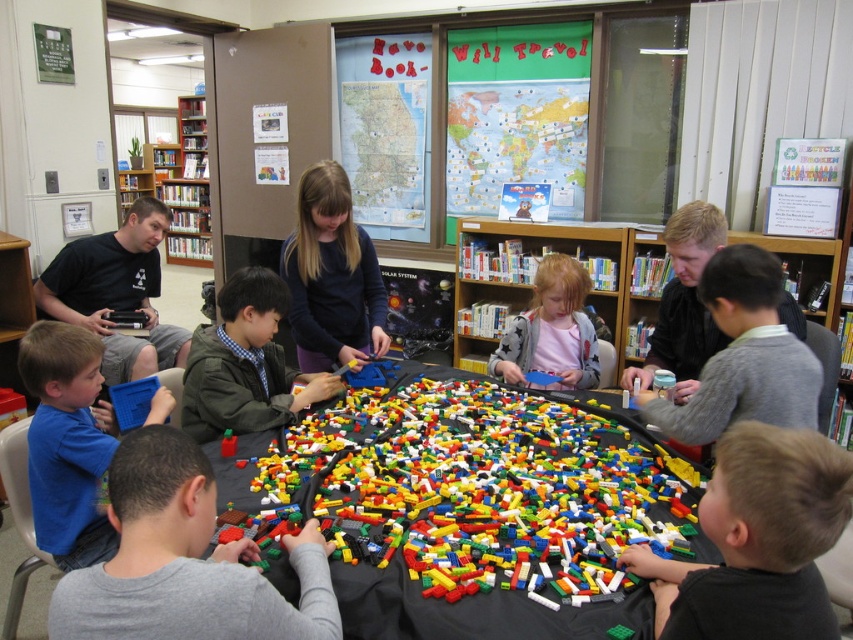
You are standing at the center of the library and see two points marked on the floor. One is at point (389, 605) and the other is at point (306, 212). Which point is closer to you?

Point (389, 605) is closer to the camera than point (306, 212), so the point at (389, 605) is closer to you.

You are a visitor at this event and want to join the LEGO activity. You see the black fabric table at center and the matte black shirt at left. Which object is closer to you as you stand at the entrance?

The black fabric table at center is closer to you because it is in front of the matte black shirt at left, meaning the shirt is further back in the scene.